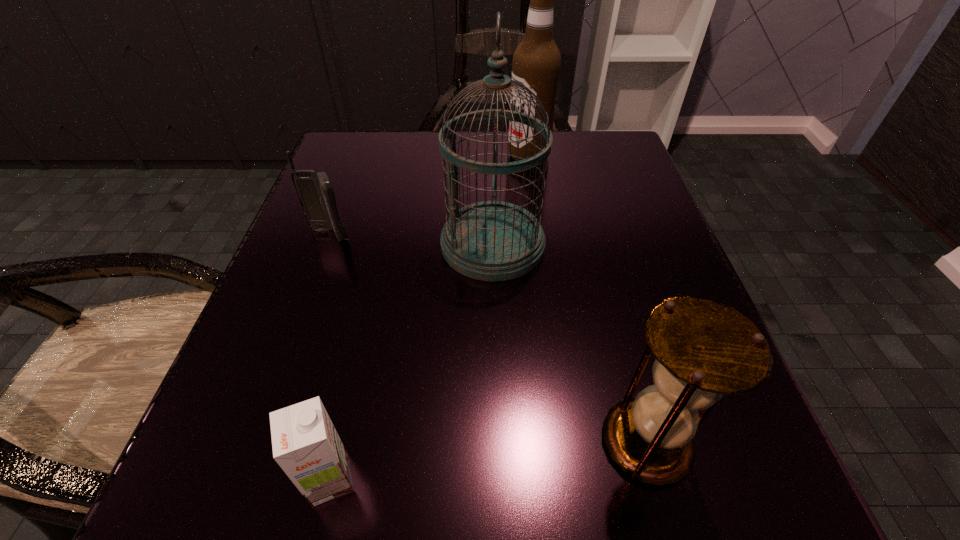
At what (x,y) coordinates should I click in order to perform the action: click on the farthest object. Please return your answer as a coordinate pair (x, y). This screenshot has height=540, width=960. Looking at the image, I should click on (536, 63).

Where is `birdcage`? The width and height of the screenshot is (960, 540). birdcage is located at coordinates (493, 241).

I want to click on hourglass, so click(x=703, y=348).

Image resolution: width=960 pixels, height=540 pixels. I want to click on cellular telephone, so click(315, 191).

This screenshot has height=540, width=960. Find the location of `the second object from left to right`. the second object from left to right is located at coordinates (305, 443).

Image resolution: width=960 pixels, height=540 pixels. In order to click on free space located 0.230m on the label of the farthest object in this screenshot , I will do `click(401, 156)`.

The height and width of the screenshot is (540, 960). Find the location of `free spot located on the label of the farthest object`. free spot located on the label of the farthest object is located at coordinates (392, 156).

Where is `vacant space located on the label of the farthest object`? vacant space located on the label of the farthest object is located at coordinates (364, 156).

This screenshot has height=540, width=960. In order to click on free region located 0.170m on the front-facing side of the birdcage in this screenshot , I will do point(342,245).

Locate an element on the screen. The height and width of the screenshot is (540, 960). vacant region located 0.080m on the front-facing side of the birdcage is located at coordinates (394, 245).